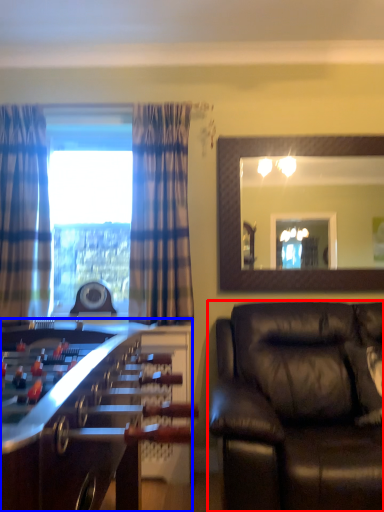
Question: Which object is further to the camera taking this photo, studio couch (highlighted by a red box) or table (highlighted by a blue box)?

Choices:
 (A) studio couch
 (B) table

Answer: (A)